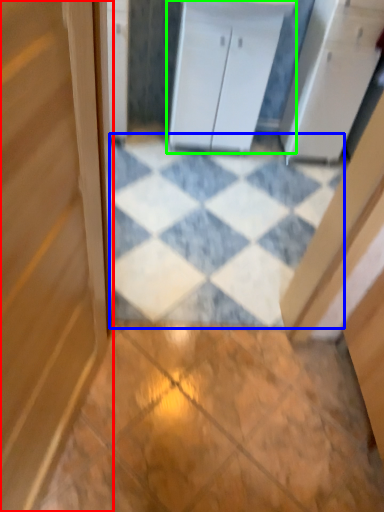
Question: Based on their relative distances, which object is farther from door (highlighted by a red box)? Choose from tile (highlighted by a blue box) and cabinetry (highlighted by a green box).

Choices:
 (A) tile
 (B) cabinetry

Answer: (B)